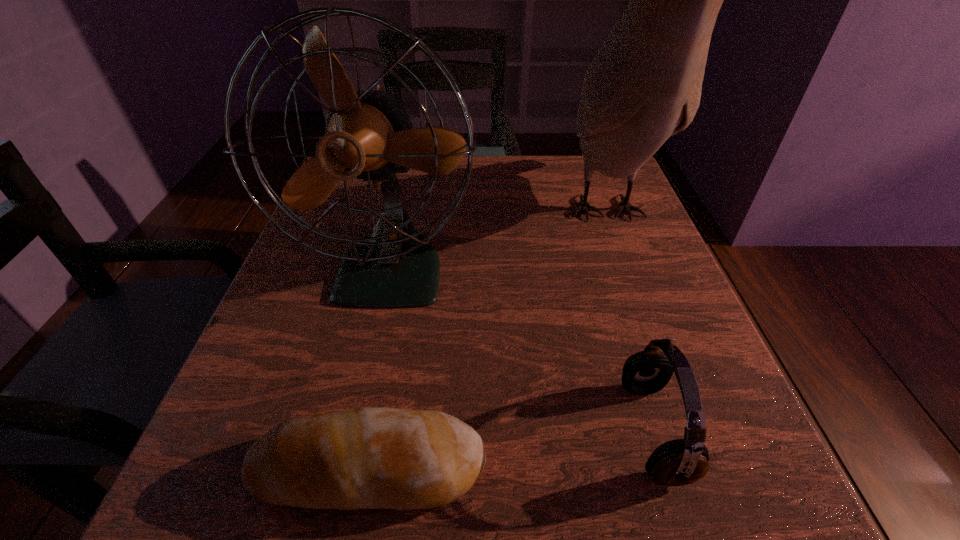
In the image, there is a desktop. At what (x,y) coordinates should I click in order to perform the action: click on free region at the far edge. Please return your answer as a coordinate pair (x, y). The image size is (960, 540). Looking at the image, I should click on (482, 174).

Locate an element on the screen. vacant space at the left edge of the desktop is located at coordinates (352, 211).

This screenshot has width=960, height=540. Identify the location of vacant area at the right edge. (722, 432).

Locate an element on the screen. free space at the far right corner of the desktop is located at coordinates (597, 203).

This screenshot has height=540, width=960. In order to click on vacant point located between the fan and the tallest object in this screenshot , I will do `click(498, 242)`.

Locate an element on the screen. empty space between the headset and the parakeet is located at coordinates (629, 322).

Where is `vacant area between the parakeet and the fan`? The image size is (960, 540). vacant area between the parakeet and the fan is located at coordinates 498,242.

At what (x,y) coordinates should I click in order to perform the action: click on free space between the second tallest object and the tallest object. Please return your answer as a coordinate pair (x, y). The width and height of the screenshot is (960, 540). Looking at the image, I should click on (498, 242).

You are a GUI agent. You are given a task and a screenshot of the screen. Output one action in this format:
    pyautogui.click(x=<x>, y=<y>)
    Task: Click on the unoccupied area between the bread and the parakeet
    This screenshot has height=540, width=960.
    Given the screenshot: What is the action you would take?
    pyautogui.click(x=487, y=341)

Where is `free point between the second shortest object and the parakeet`? free point between the second shortest object and the parakeet is located at coordinates (629, 322).